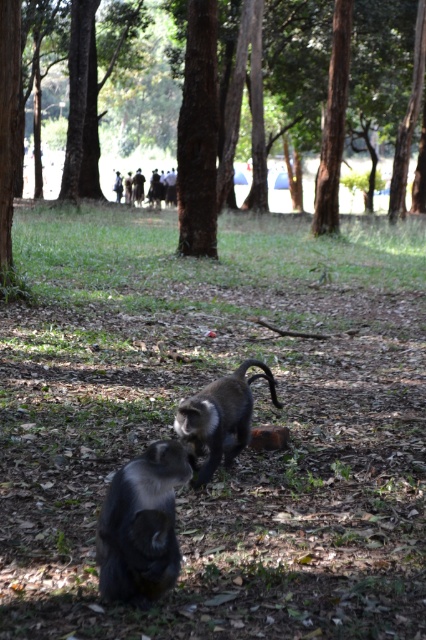
You are a wildlife photographer trying to capture a photo of both the silvery fur monkey at center and the shiny brown monkey at center. Since you want to ensure both monkeys are fully visible in the frame, which monkey should you position closer to the camera to avoid being obscured by the other?

You should position the shiny brown monkey at center closer to the camera because it is shorter than the silvery fur monkey at center, so placing it forward will prevent it from being hidden behind the taller monkey.

Based on the photo, you are a wildlife photographer aiming to capture a closeup shot of the monkey with silvery fur at center. You have a camera with a zoom lens that can focus on objects within a 0.5 unit radius. Given that the point marking the monkey is at coordinates point (253, 422), will your camera be able to focus on the monkey if you position yourself at the origin point 0,0?

The point marking the silvery fur monkey at center is located at coordinates point (253, 422). The distance from the origin 0,0 to this point is sqrt0.661 squared plus 0.596 squared equals approximately sqrt0.437 plus 0.355 equals sqrt0.792 equals approximately 0.89 units. Since the camera can focus within 0.5 units, the distance of 0.89 units exceeds the 0.5 unit range. Therefore, the camera cannot focus on the monkey with silvery fur at center from the origin point 0,0.

You are standing at the origin point in the image and want to locate the silvery fur monkey at center. According to the coordinates provided, in which direction should you move to find it?

The silvery fur monkey at center is located at coordinates point (x=253, y=422), so you should move to the right and slightly upward from the origin point to reach it.